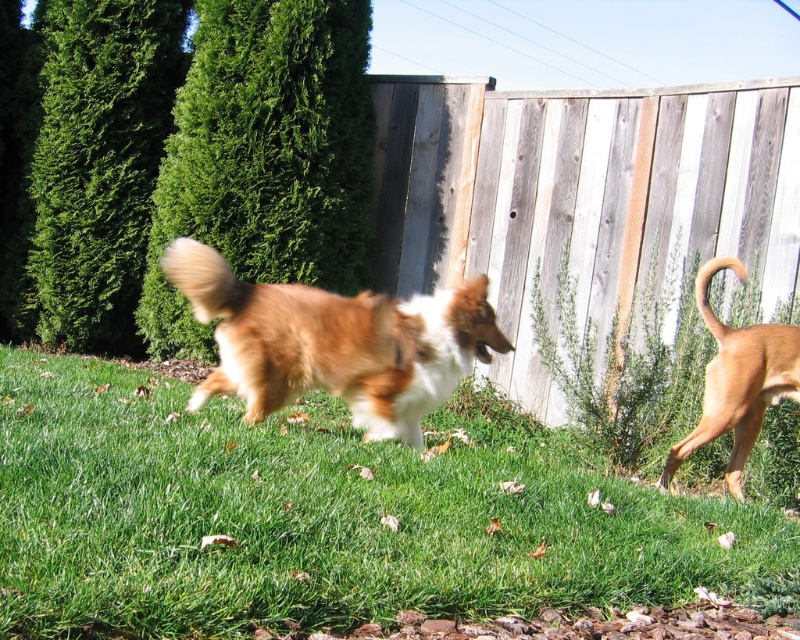
You are standing in the backyard and want to locate the weathered wood fence at center. Which part of the scene should you look towards?

You should look towards the center of the scene because the weathered wood fence at center is located at point (580, 193), which corresponds to the central area.

Consider the image. You are a photographer trying to capture a clear shot of the brown furry dog at center. However, the green grass at center is blocking your view. Can you adjust your position to see the dog without the grass obstructing it?

The green grass at center is in front of the brown furry dog at center, so moving your camera position slightly behind the grass might allow you to see the dog without obstruction.

You are a photographer trying to capture both the weathered wood fence at center and the brown furry tail at right in the same frame. Based on their heights, which one should you focus on first to ensure both are visible?

The weathered wood fence at center is taller than the brown furry tail at right, so you should focus on the weathered wood fence at center first to ensure both are visible in the frame.